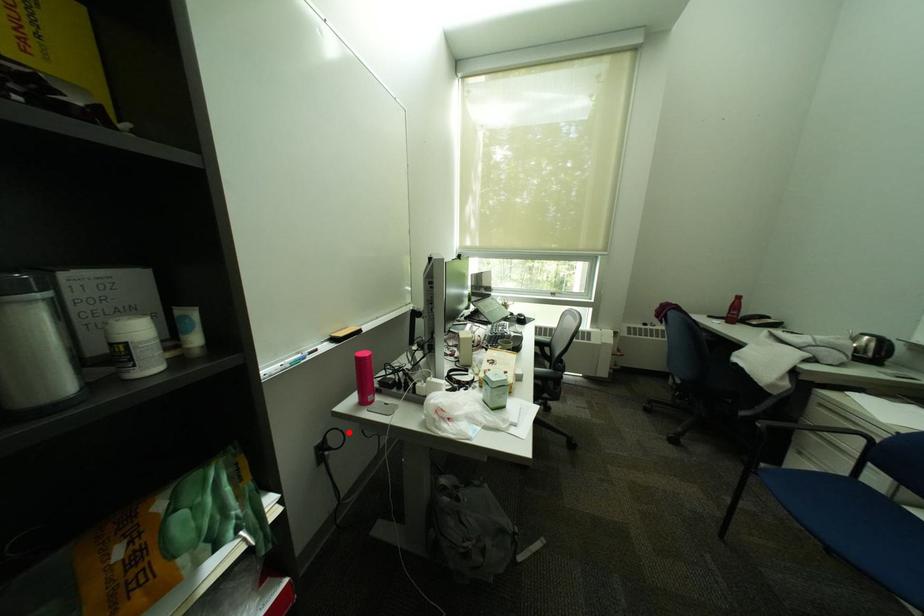
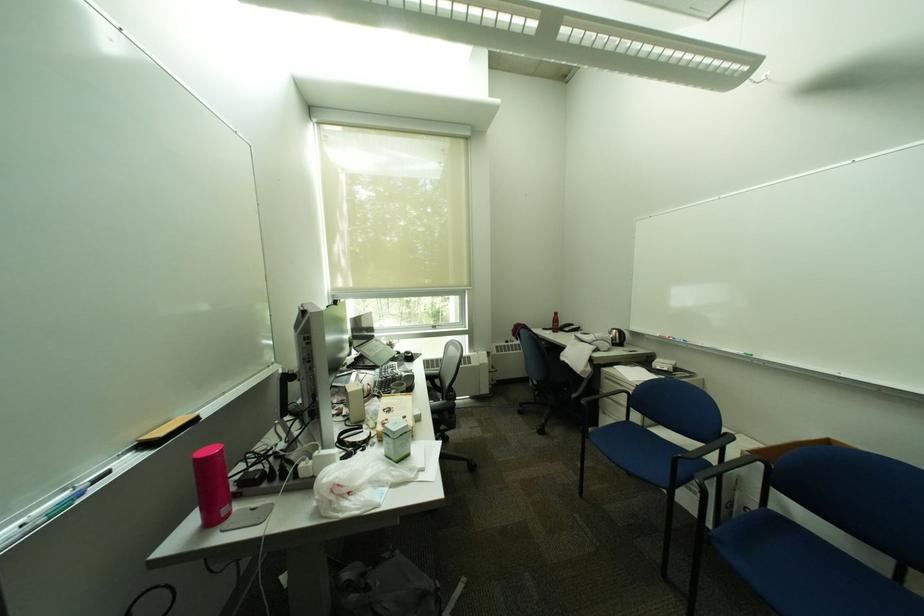
Locate, in the second image, the point that corresponds to the highlighted location in the first image.

(168, 591)